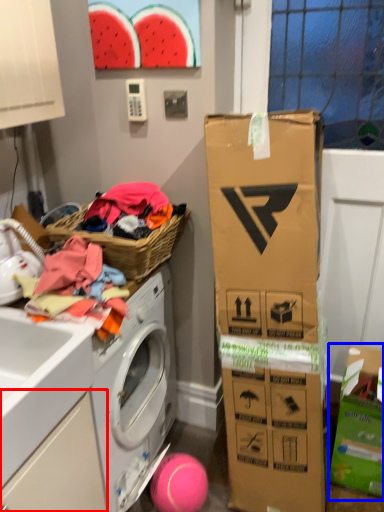
Question: Which point is closer to the camera, drawer (highlighted by a red box) or cardboard box (highlighted by a blue box)?

Choices:
 (A) drawer
 (B) cardboard box

Answer: (A)